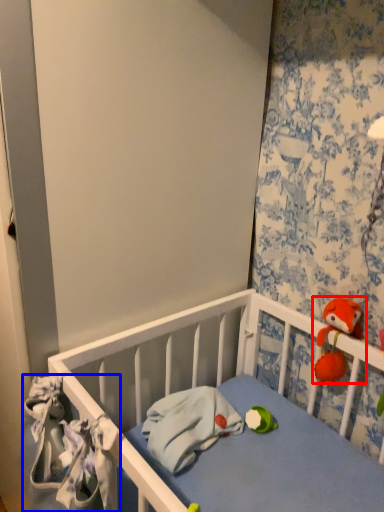
Question: Which point is closer to the camera, toy (highlighted by a red box) or material (highlighted by a blue box)?

Choices:
 (A) toy
 (B) material

Answer: (B)